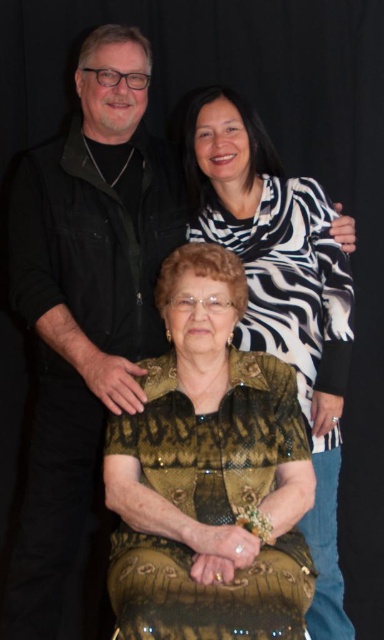
Between matte black vest at upper left and gold textured dress at center, which one is positioned lower?

gold textured dress at center is below.

Does matte black vest at upper left have a larger size compared to gold textured dress at center?

Actually, matte black vest at upper left might be smaller than gold textured dress at center.

The image size is (384, 640). I want to click on matte black vest at upper left, so click(84, 305).

Identify the location of matte black vest at upper left. (84, 305).

Is gold textured blouse at center bigger than gold textured dress at center?

Actually, gold textured blouse at center might be smaller than gold textured dress at center.

Consider the image. Does gold textured blouse at center appear on the right side of gold textured dress at center?

In fact, gold textured blouse at center is to the left of gold textured dress at center.

From the picture: Who is more distant from viewer, (170, 483) or (221, 122)?

The point (221, 122) is behind.

Image resolution: width=384 pixels, height=640 pixels. What are the coordinates of `gold textured blouse at center` in the screenshot? It's located at (210, 474).

Based on the photo, is gold textured blouse at center in front of matte black vest at upper left?

That is True.

Which is more to the right, gold textured blouse at center or matte black vest at upper left?

Positioned to the right is gold textured blouse at center.

Is point (205, 376) more distant than point (100, 298)?

That is False.

Identify the location of gold textured blouse at center. This screenshot has height=640, width=384. (210, 474).